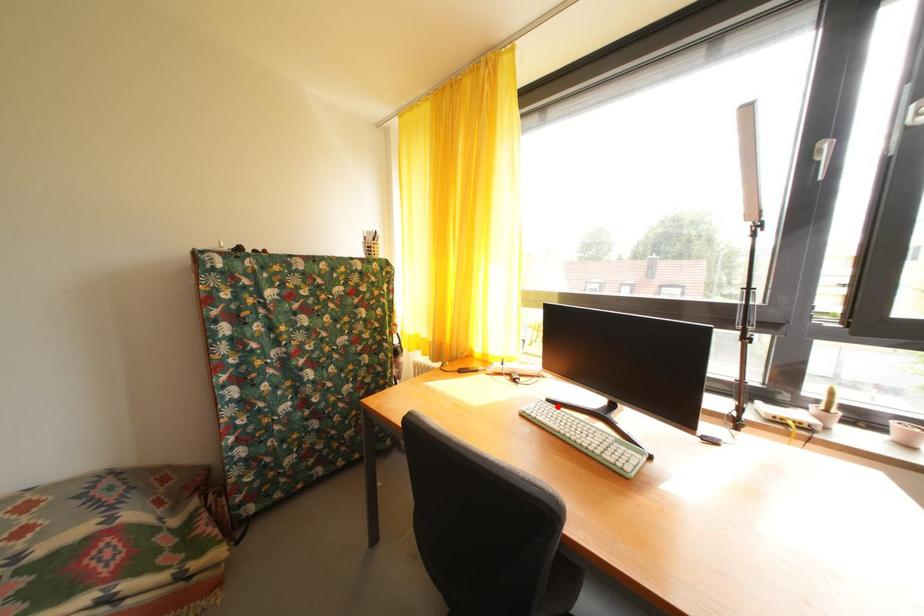
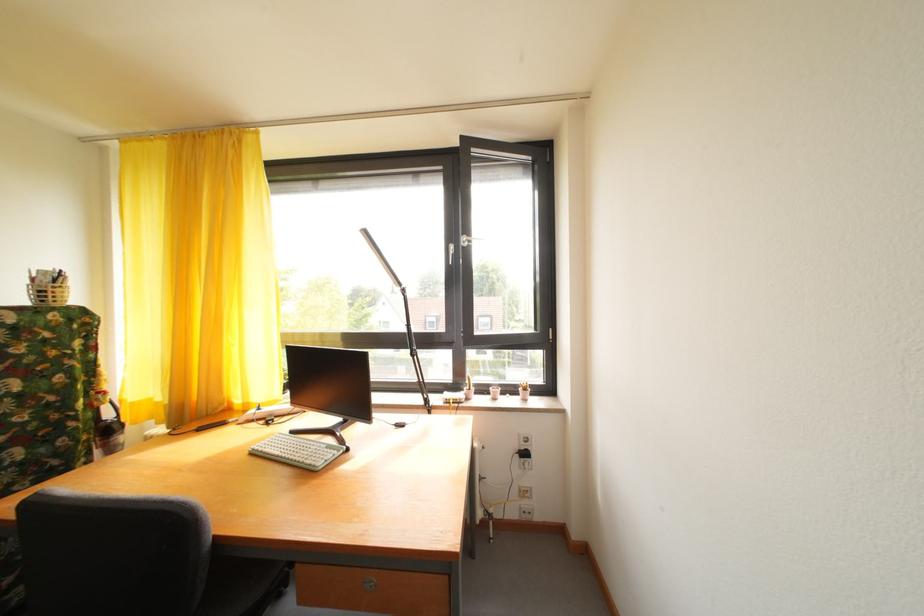
Find the pixel in the second image that matches the highlighted location in the first image.

(301, 438)